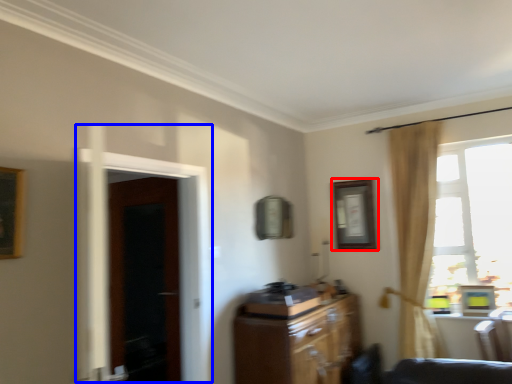
Question: Among these objects, which one is farthest to the camera, picture frame (highlighted by a red box) or screen door (highlighted by a blue box)?

Choices:
 (A) picture frame
 (B) screen door

Answer: (A)